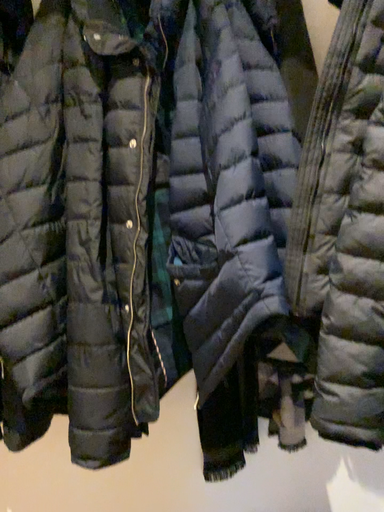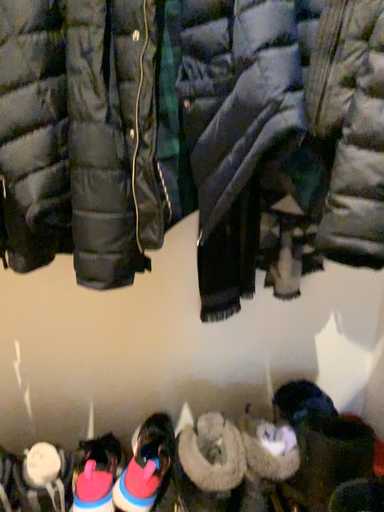
Question: How did the camera likely rotate when shooting the video?

Choices:
 (A) rotated upward
 (B) rotated downward

Answer: (B)